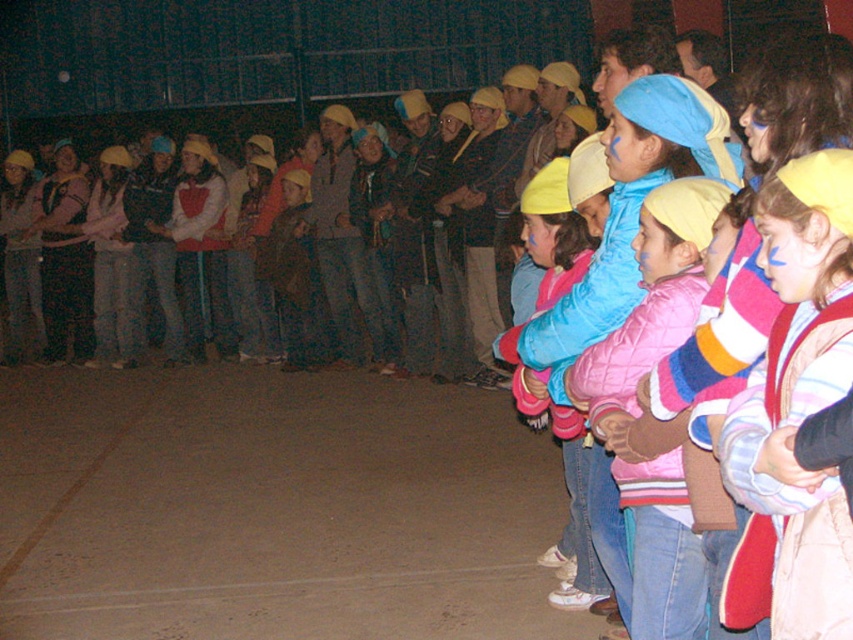
You are a photographer trying to capture a photo of the children in the scene. You notice two jackets in the center area. Which jacket is positioned to the right of the other? The pink quilted jacket at center or the matte blue jacket at center?

The pink quilted jacket at center is positioned to the right of the matte blue jacket at center.